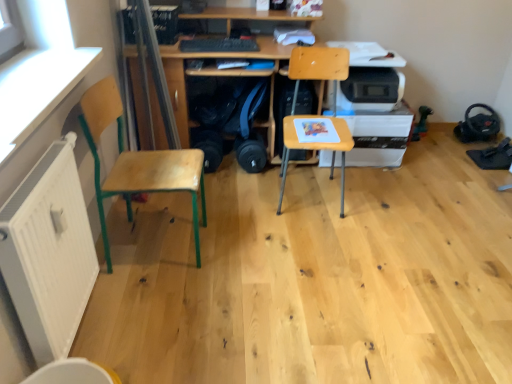
Where is `vacant area situated below wooden chair at center, arranged as the first chair when viewed from the right (from a real-world perspective)`? The width and height of the screenshot is (512, 384). vacant area situated below wooden chair at center, arranged as the first chair when viewed from the right (from a real-world perspective) is located at coordinates (308, 194).